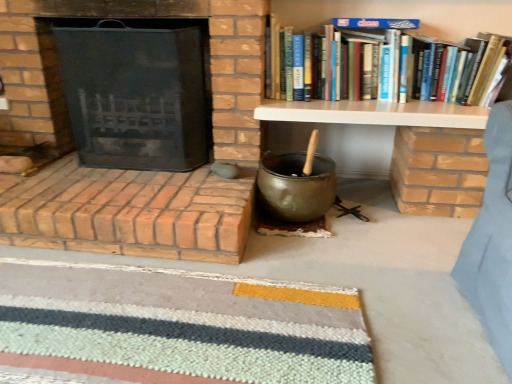
You are a GUI agent. You are given a task and a screenshot of the screen. Output one action in this format:
    pyautogui.click(x=<x>, y=<y>)
    Task: Click on the vacant space in front of black mesh fireplace screen at left, the 1th fireplace in the top-to-bottom sequence
    The width and height of the screenshot is (512, 384).
    Given the screenshot: What is the action you would take?
    pyautogui.click(x=122, y=193)